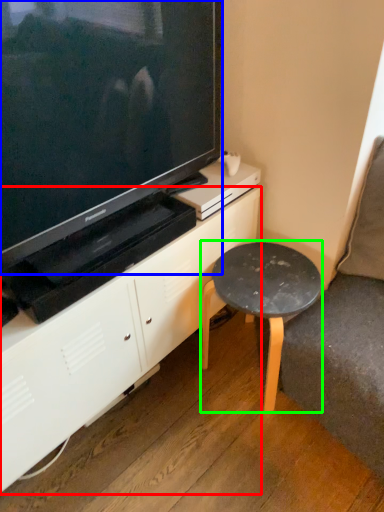
Question: Which object is the closest to the cabinetry (highlighted by a red box)? Choose among these: television (highlighted by a blue box) or stool (highlighted by a green box).

Choices:
 (A) television
 (B) stool

Answer: (B)